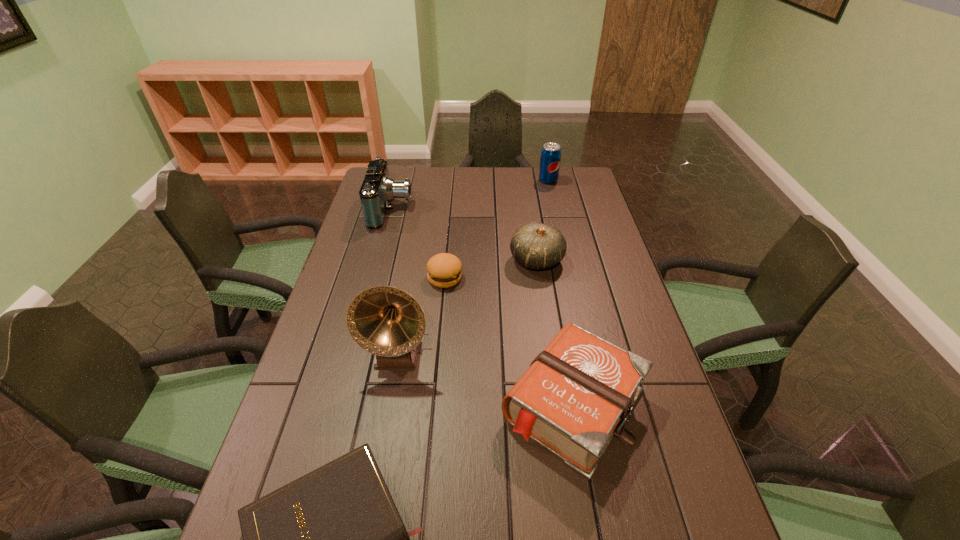
The image size is (960, 540). What are the coordinates of `the tallest object` in the screenshot? It's located at (386, 321).

Locate an element on the screen. the sixth nearest object is located at coordinates (378, 189).

Identify the location of pop soda. (550, 158).

Where is `gourd`? gourd is located at coordinates (536, 246).

In order to click on the right Bible in this screenshot , I will do `click(576, 395)`.

The height and width of the screenshot is (540, 960). I want to click on hamburger, so click(x=444, y=270).

The image size is (960, 540). Identify the location of free space located 0.100m on the horn of the tallest object. (387, 411).

Identify the location of vacant space located 0.120m on the front-facing side of the camcorder. Image resolution: width=960 pixels, height=540 pixels. (444, 209).

Find the location of a particular element. The image size is (960, 540). vacant space located on the left of the pop soda is located at coordinates (452, 180).

Where is `vacant area located on the back of the gourd`? This screenshot has width=960, height=540. vacant area located on the back of the gourd is located at coordinates (529, 206).